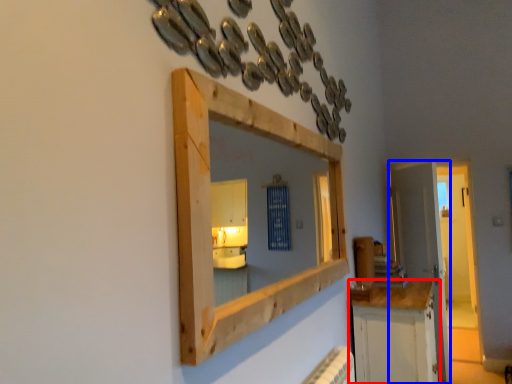
Question: Which of the following is the farthest to the observer, cabinetry (highlighted by a red box) or door (highlighted by a blue box)?

Choices:
 (A) cabinetry
 (B) door

Answer: (B)